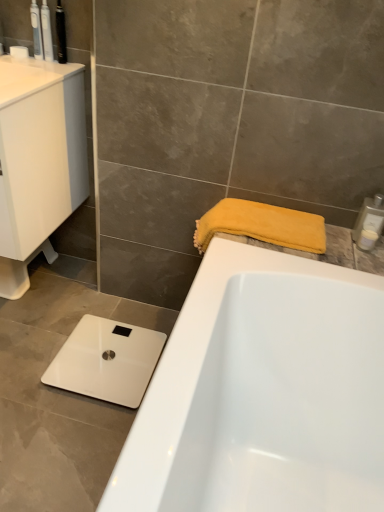
You are a GUI agent. You are given a task and a screenshot of the screen. Output one action in this format:
    pyautogui.click(x=<x>, y=<y>)
    Task: Click on the vacant area that lies in front of translucent plastic toothbrush at upper left, which is the first toiletry in top-to-bottom order
    The height and width of the screenshot is (512, 384).
    Given the screenshot: What is the action you would take?
    pyautogui.click(x=39, y=68)